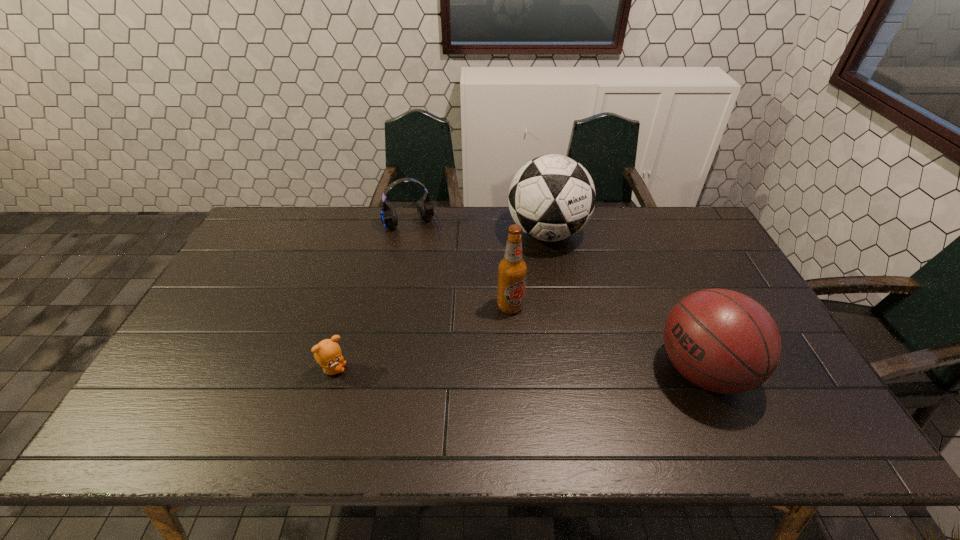
At what (x,y) coordinates should I click in order to perform the action: click on vacant space on the desktop that is between the shortest object and the rightmost object and is positioned on the front label of the beer bottle. Please return your answer as a coordinate pair (x, y). This screenshot has height=540, width=960. Looking at the image, I should click on (547, 370).

The height and width of the screenshot is (540, 960). I want to click on vacant spot on the desktop that is between the teddy bear and the third tallest object and is positioned on the ear cushions of the second shortest object, so click(x=481, y=370).

Find the location of a particular element. This screenshot has width=960, height=540. vacant spot on the desktop that is between the teddy bear and the basketball and is positioned on the surface of the soccer ball where the brand logo is visible is located at coordinates (551, 370).